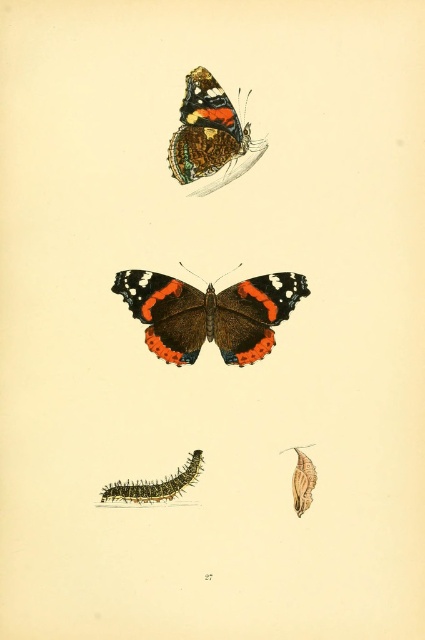
Question: Which object is positioned farthest from the shiny brown butterfly at center?

Choices:
 (A) fuzzy brown caterpillar at lower left
 (B) matte brown chrysalis at center

Answer: (B)

Question: Which object is the farthest from the matte orange butterfly at upper center?

Choices:
 (A) matte brown chrysalis at center
 (B) shiny brown butterfly at center
 (C) fuzzy brown caterpillar at lower left

Answer: (A)

Question: Is matte orange butterfly at upper center bigger than matte brown chrysalis at center?

Choices:
 (A) no
 (B) yes

Answer: (B)

Question: Is matte orange butterfly at upper center further to the viewer compared to matte brown chrysalis at center?

Choices:
 (A) yes
 (B) no

Answer: (B)

Question: Does fuzzy brown caterpillar at lower left come in front of matte brown chrysalis at center?

Choices:
 (A) no
 (B) yes

Answer: (A)

Question: Which point appears closest to the camera in this image?

Choices:
 (A) (311, 486)
 (B) (257, 150)

Answer: (A)